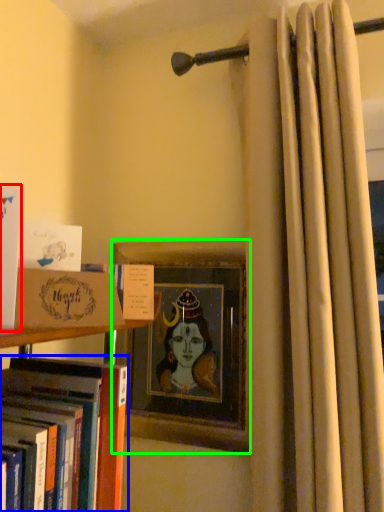
Question: Estimate the real-world distances between objects in this image. Which object is closer to book (highlighted by a red box), book (highlighted by a blue box) or picture frame (highlighted by a green box)?

Choices:
 (A) book
 (B) picture frame

Answer: (A)